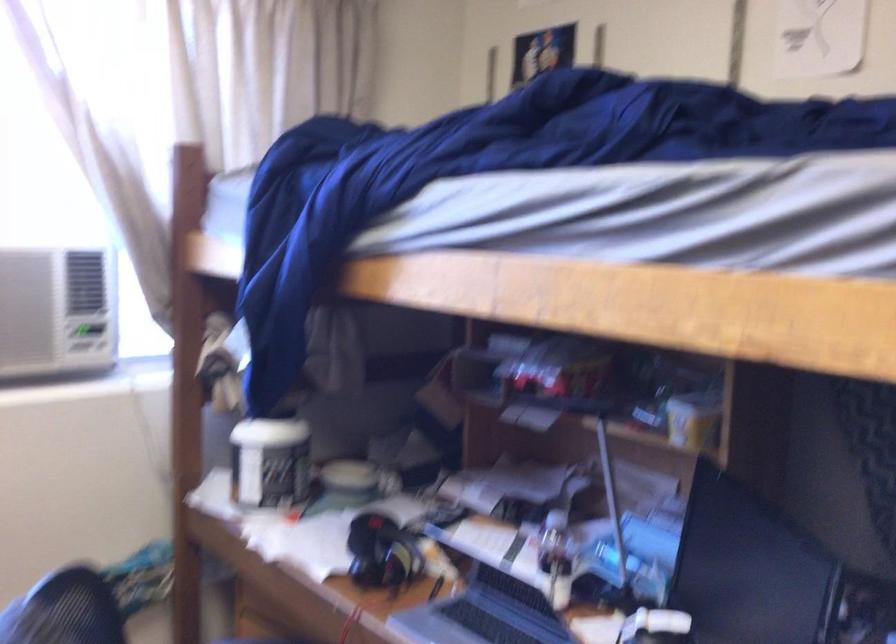
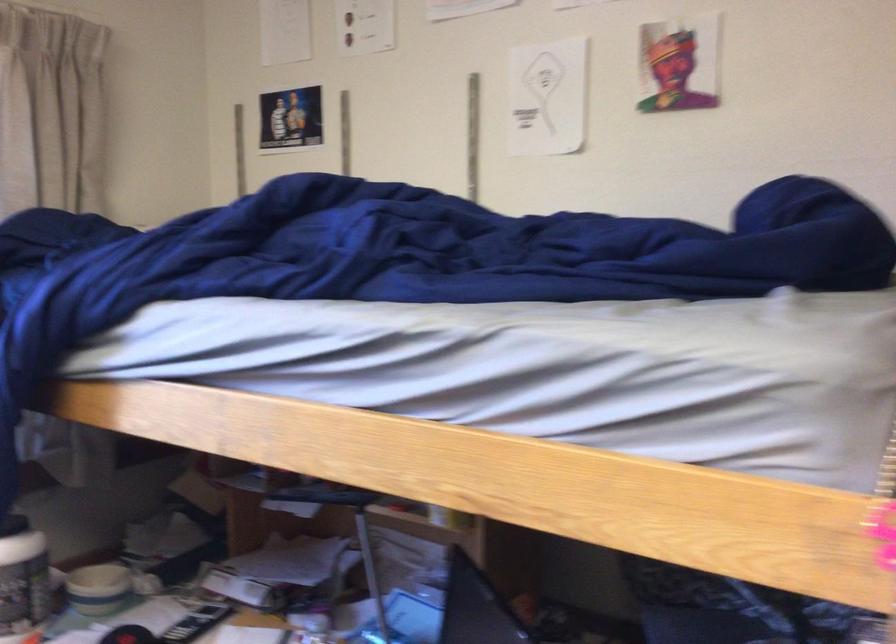
Where in the second image is the point corresponding to pixel 289 460 from the first image?

(22, 581)